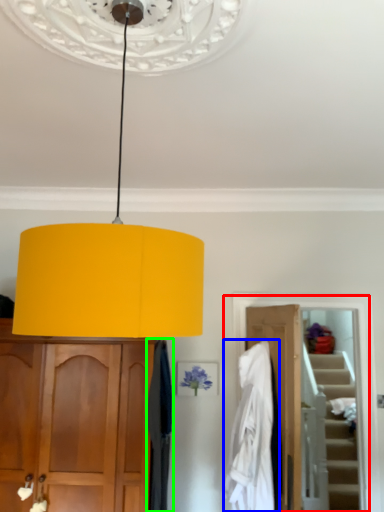
Question: Which object is positioned farthest from closet (highlighted by a red box)? Select from clothing (highlighted by a blue box) and curtain (highlighted by a green box).

Choices:
 (A) clothing
 (B) curtain

Answer: (B)